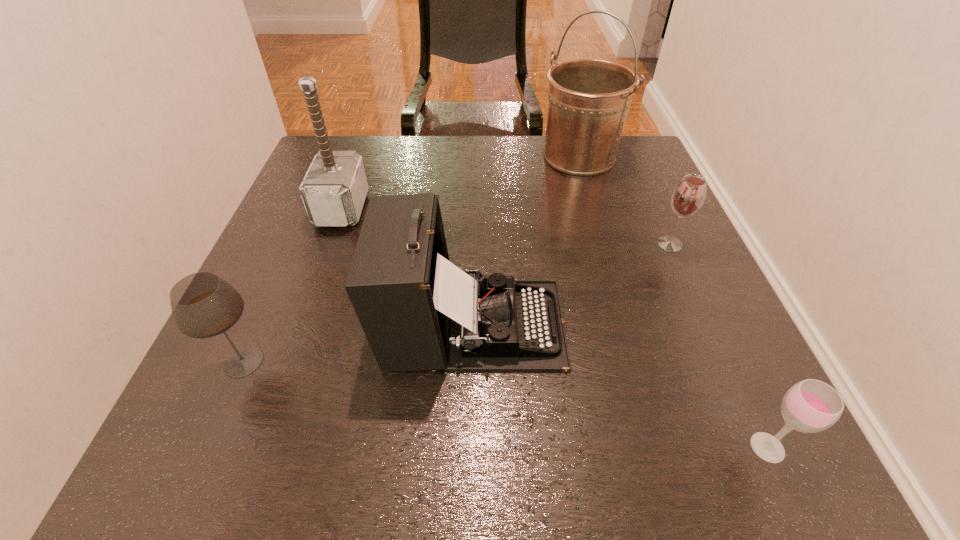
Where is `free space between the second farthest wineglass and the typewriter`? The width and height of the screenshot is (960, 540). free space between the second farthest wineglass and the typewriter is located at coordinates (358, 342).

Locate an element on the screen. The width and height of the screenshot is (960, 540). vacant space that's between the nearest wineglass and the third tallest object is located at coordinates (620, 386).

Identify the location of vacant point located between the fourth shortest object and the farthest wineglass. (571, 284).

The height and width of the screenshot is (540, 960). Find the location of `free space between the fourth object from left to right and the third tallest object`. free space between the fourth object from left to right and the third tallest object is located at coordinates (525, 240).

Image resolution: width=960 pixels, height=540 pixels. What are the coordinates of `blank region between the fifth shortest object and the leftmost wineglass` in the screenshot? It's located at (293, 285).

I want to click on vacant area that lies between the second tallest object and the second nearest wineglass, so click(x=293, y=285).

Select which object is the closest to the nearest object. Please provide its 2D coordinates. Your answer should be formatted as a tuple, i.e. [(x, y)], where the tuple contains the x and y coordinates of a point satisfying the conditions above.

[(419, 311)]

This screenshot has height=540, width=960. In order to click on object that can be found as the fourth closest to the third object from left to right in this screenshot , I will do [810, 406].

Where is `the third closest wineglass to the typewriter`? the third closest wineglass to the typewriter is located at coordinates (810, 406).

At what (x,y) coordinates should I click in order to perform the action: click on the second closest wineglass to the nearest object. Please return your answer as a coordinate pair (x, y). Looking at the image, I should click on (203, 305).